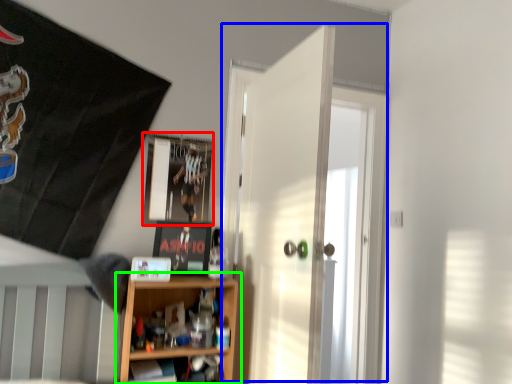
Question: Which object is positioned farthest from picture frame (highlighted by a red box)? Select from door (highlighted by a blue box) and shelf (highlighted by a green box).

Choices:
 (A) door
 (B) shelf

Answer: (B)